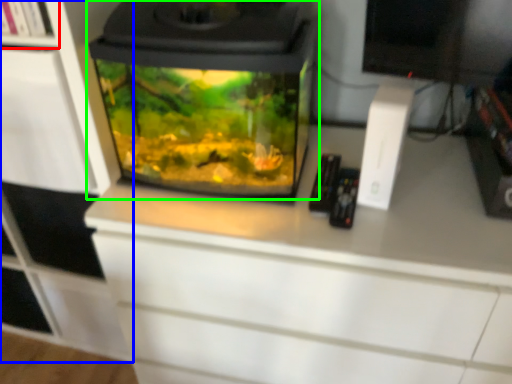
Question: Considering the real-world distances, which object is closest to shelf (highlighted by a red box)? cabinetry (highlighted by a blue box) or home appliance (highlighted by a green box).

Choices:
 (A) cabinetry
 (B) home appliance

Answer: (A)